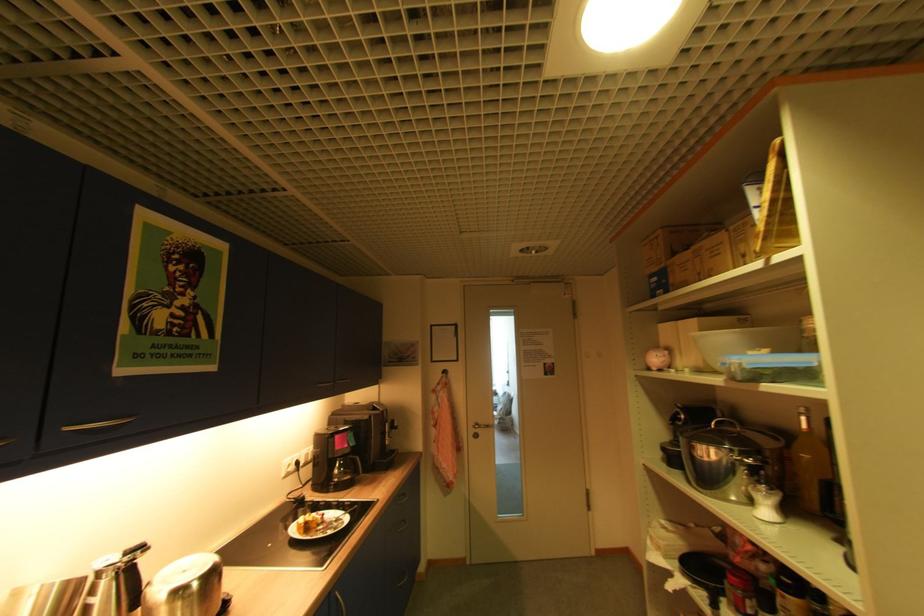
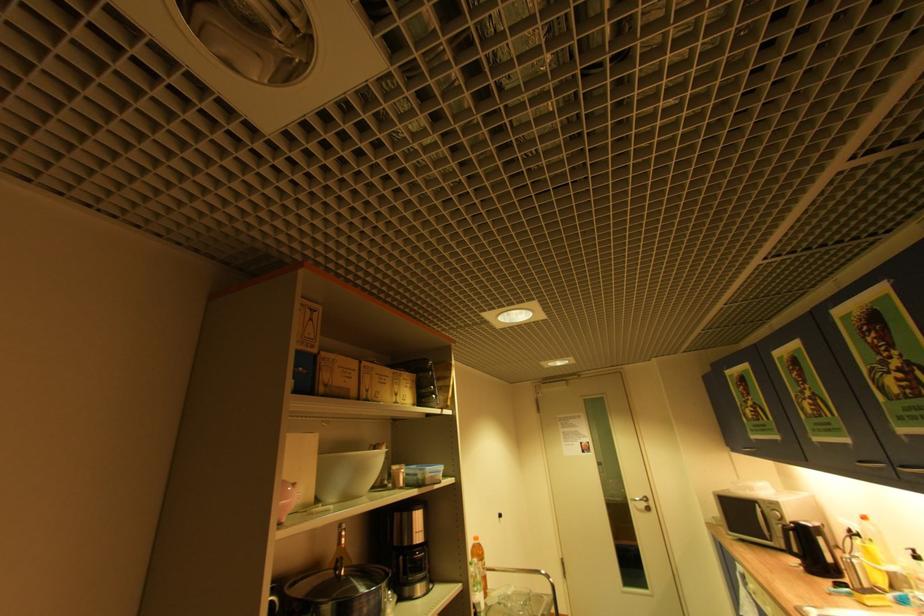
The point at (691, 272) is marked in the first image. Where is the corresponding point in the second image?

(357, 379)